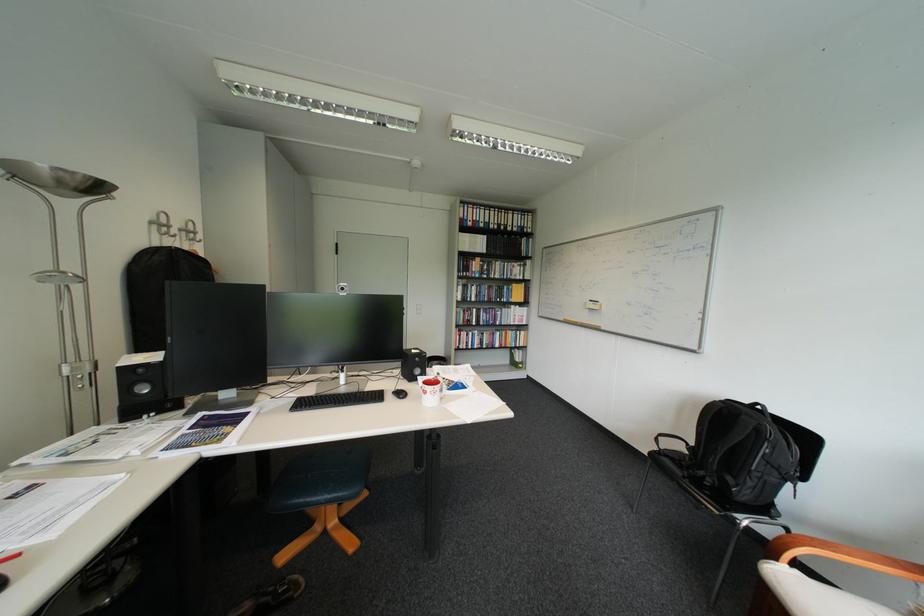
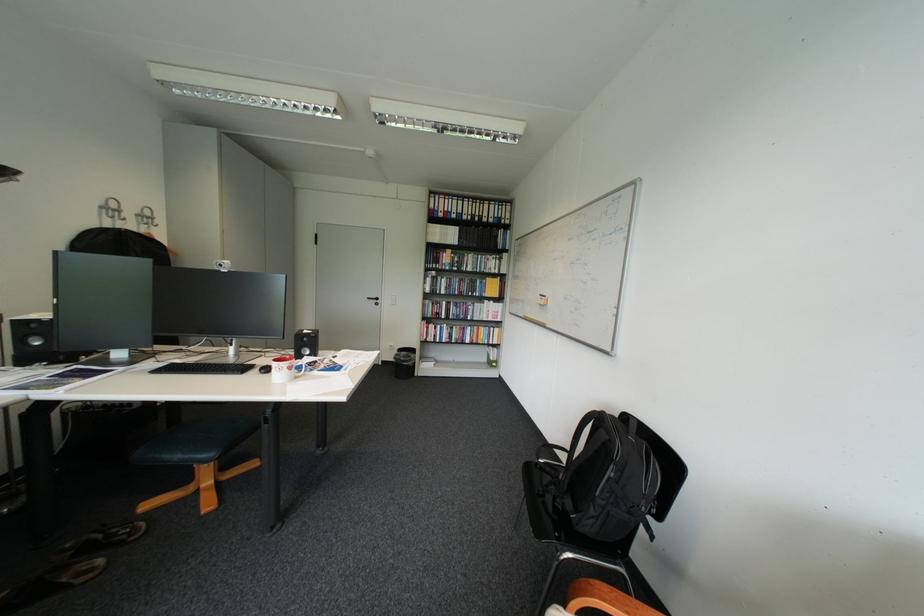
Where in the second image is the point corresponding to pixel 187 237 from the first image?

(137, 220)